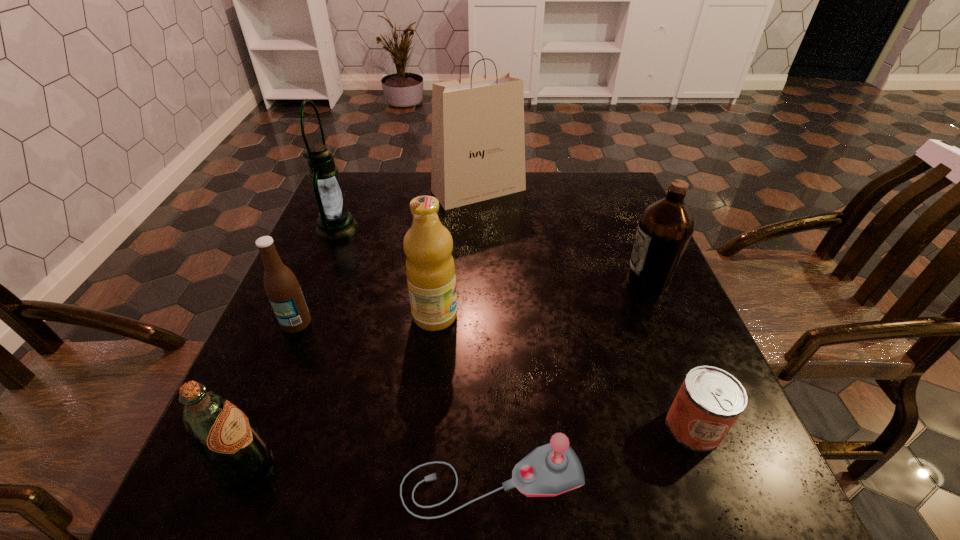
The height and width of the screenshot is (540, 960). Identify the location of olive oil that is the closest to the lantern. (430, 269).

Where is `blank space that satisfies the following two spatial constraints: 1. on the front-facing side of the leftmost olive oil; 2. on the left side of the joystick`? This screenshot has height=540, width=960. blank space that satisfies the following two spatial constraints: 1. on the front-facing side of the leftmost olive oil; 2. on the left side of the joystick is located at coordinates (237, 480).

The width and height of the screenshot is (960, 540). I want to click on blank space that satisfies the following two spatial constraints: 1. on the side where the lantern emits light; 2. on the right side of the can, so click(255, 427).

Find the location of a particular element. vacant space that satisfies the following two spatial constraints: 1. on the back side of the joystick; 2. on the side where the second farthest object emits light is located at coordinates (487, 227).

Where is `free space that satisfies the following two spatial constraints: 1. on the front side of the beer bottle; 2. on the left side of the can`? The image size is (960, 540). free space that satisfies the following two spatial constraints: 1. on the front side of the beer bottle; 2. on the left side of the can is located at coordinates (253, 427).

You are a GUI agent. You are given a task and a screenshot of the screen. Output one action in this format:
    pyautogui.click(x=<x>, y=<y>)
    Task: Click on the free space in the image that satisfies the following two spatial constraints: 1. on the front side of the joystick; 2. on the left side of the farthest object
    The image size is (960, 540).
    Given the screenshot: What is the action you would take?
    pyautogui.click(x=477, y=480)

The image size is (960, 540). In order to click on free space that satisfies the following two spatial constraints: 1. on the side where the can emits light; 2. on the right side of the seventh nearest object in this screenshot , I will do `click(255, 427)`.